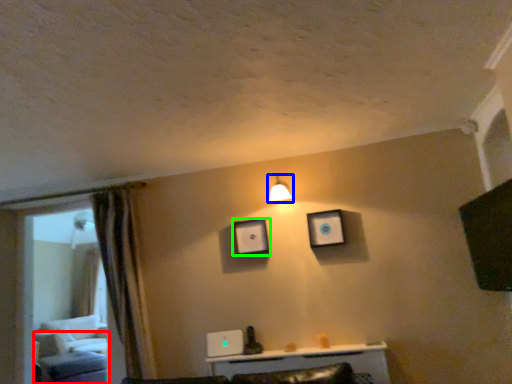
Question: Based on their relative distances, which object is farther from furniture (highlighted by a red box)? Choose from light fixture (highlighted by a blue box) and picture frame (highlighted by a green box).

Choices:
 (A) light fixture
 (B) picture frame

Answer: (A)